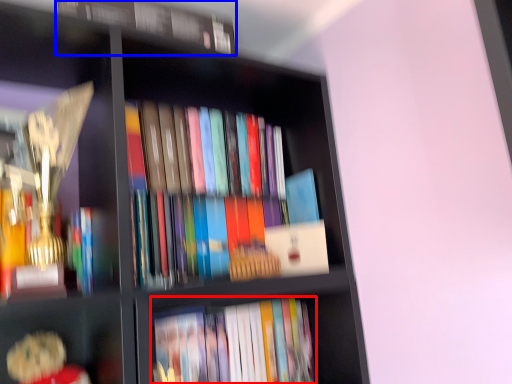
Question: Which object is closer to the camera taking this photo, book (highlighted by a red box) or book (highlighted by a blue box)?

Choices:
 (A) book
 (B) book

Answer: (B)